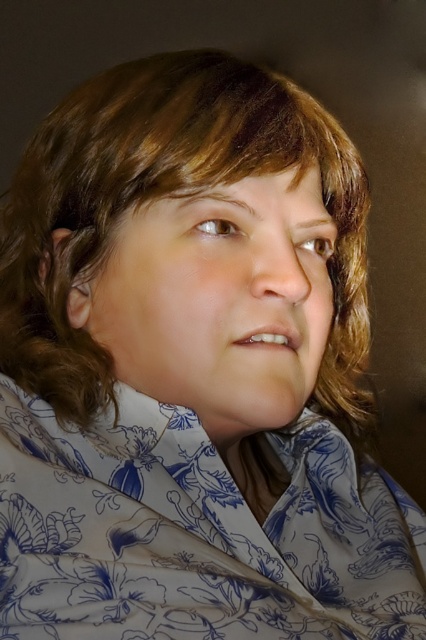
Is point (190, 422) positioned before point (316, 205)?

That is True.

Which is below, white floral fabric at center or smooth skin face at center?

white floral fabric at center

Which is in front, point (140, 566) or point (219, 285)?

Point (140, 566) is more forward.

The width and height of the screenshot is (426, 640). I want to click on white floral fabric at center, so click(195, 532).